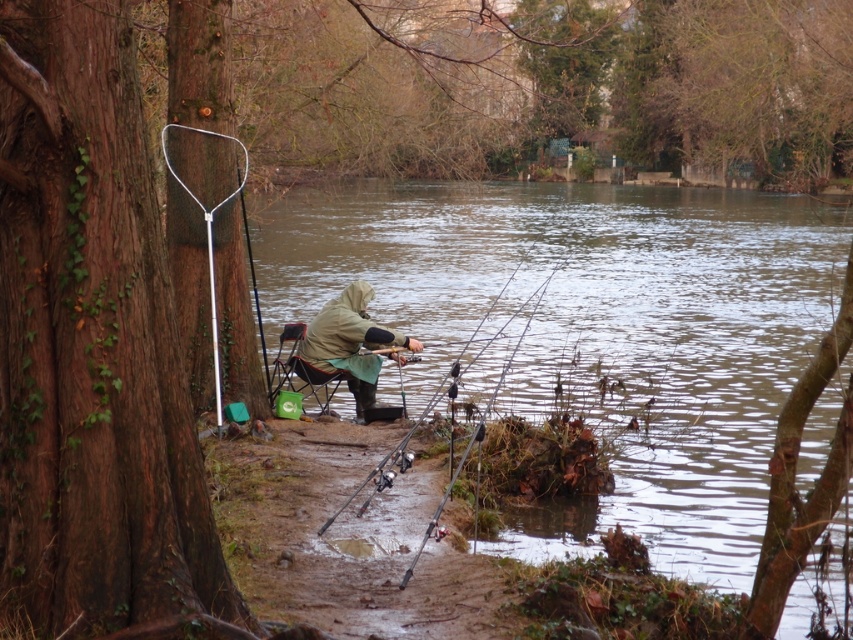
Based on the scene described, what is the 2D coordinate of the clear water at center?

The clear water at center is located at the 2D coordinate point of (596, 330).

You are a photographer trying to capture the black plastic fishing pole at center and the brown rough tree trunk at left in the same frame. Since you want both objects to be clearly visible, which object should you position closer to the camera to ensure both are in focus?

The brown rough tree trunk at left is positioned on the left side of black plastic fishing pole at center. To ensure both are in focus, you should position the brown rough tree trunk at left closer to the camera since it is already to the left of the fishing pole, allowing for a greater depth of field when framing both objects.